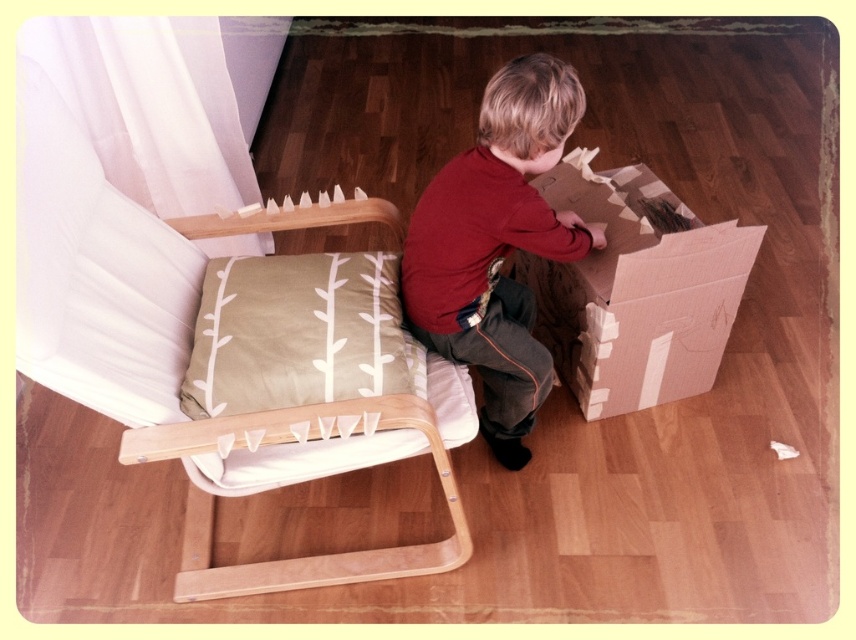
Question: Can you confirm if red cotton shirt at center is positioned to the right of cardboard box at lower right?

Choices:
 (A) no
 (B) yes

Answer: (A)

Question: Which point is closer to the camera taking this photo?

Choices:
 (A) (242, 257)
 (B) (415, 572)
 (C) (589, 232)

Answer: (C)

Question: Which point is farther to the camera?

Choices:
 (A) (x=375, y=257)
 (B) (x=415, y=292)
 (C) (x=294, y=214)

Answer: (C)

Question: Is red cotton shirt at center above green fabric pillow at center?

Choices:
 (A) no
 (B) yes

Answer: (B)

Question: Which object appears closest to the camera in this image?

Choices:
 (A) green fabric pillow at center
 (B) wooden cushioned chair at center
 (C) red cotton shirt at center
 (D) cardboard box at lower right

Answer: (B)

Question: Is wooden cushioned chair at center wider than green fabric pillow at center?

Choices:
 (A) no
 (B) yes

Answer: (B)